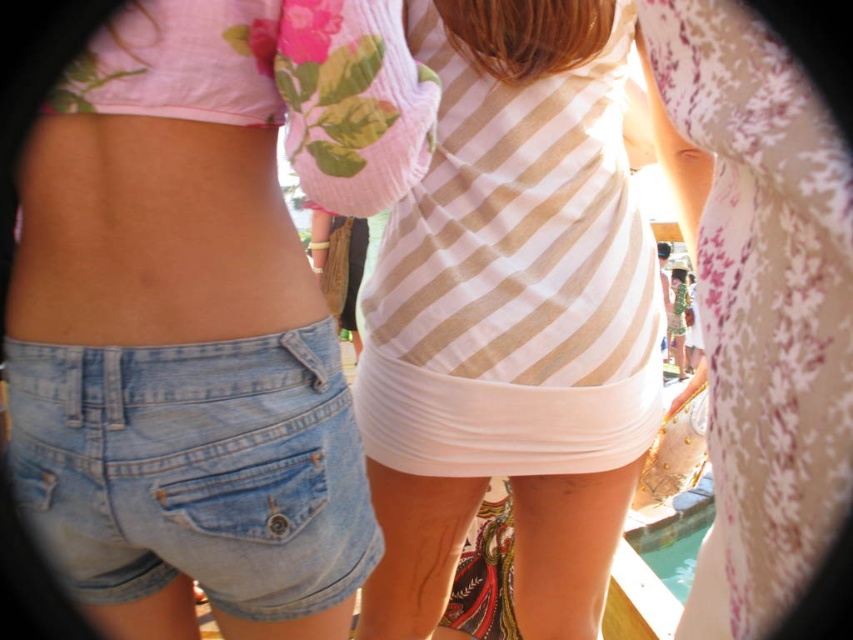
You are organizing a clothing inventory and need to determine the stacking order of items in the image. Which item is placed above the other between the white striped tank top at center and the white matte underwear at center?

The white striped tank top at center is positioned over the white matte underwear at center, so it is placed above the white matte underwear at center in the stacking order.

You are standing at the center of the image and want to find the white striped tank top at center. Based on its coordinates, is it directly in front of you or to one side?

The white striped tank top at center is located at coordinates point (x=511, y=317), which is very close to the center point (x=426, y=320). Therefore, it is directly in front of you.

You are standing at the back of the group in the image and want to see the person wearing denim shorts at left. Can you see the light blue denim shorts at lower left behind them?

The denim shorts at left is in front of light blue denim shorts at lower left, so you cannot see the light blue denim shorts at lower left behind them because it is obscured by the person in front.